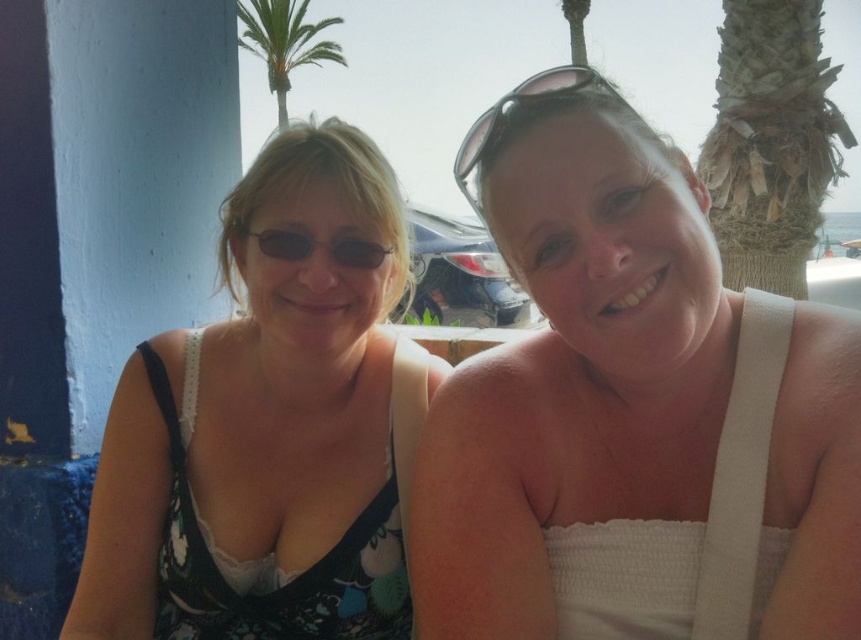
Question: Can you confirm if white textured top at center is positioned below floral fabric dress at left?

Choices:
 (A) no
 (B) yes

Answer: (A)

Question: Which object is the farthest from the sunglasses at upper right?

Choices:
 (A) white textured top at center
 (B) floral fabric dress at left
 (C) green leafy palm tree at upper center
 (D) matte black sunglasses at center

Answer: (C)

Question: Based on their relative distances, which object is farther from the green leafy palm tree at upper center?

Choices:
 (A) matte black sunglasses at center
 (B) floral fabric dress at left
 (C) sunglasses at upper right

Answer: (A)

Question: Among these objects, which one is nearest to the camera?

Choices:
 (A) matte black sunglasses at center
 (B) green leafy palm tree at upper center

Answer: (A)

Question: Is green leafy palm tree at upper center closer to camera compared to sunglasses at upper right?

Choices:
 (A) yes
 (B) no

Answer: (B)

Question: Can you confirm if white textured top at center is smaller than floral fabric dress at left?

Choices:
 (A) no
 (B) yes

Answer: (B)